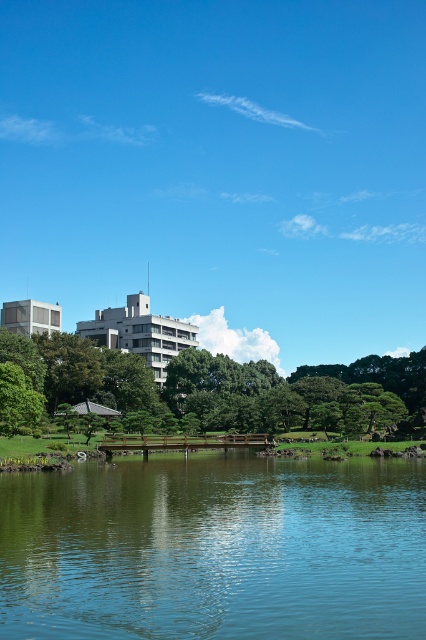
From the picture: Is transparent glass water at center above green leafy tree at center?

No.

Is point (268, 504) in front of point (238, 416)?

Yes, point (268, 504) is in front of point (238, 416).

What do you see at coordinates (215, 548) in the screenshot? I see `transparent glass water at center` at bounding box center [215, 548].

This screenshot has width=426, height=640. In order to click on transparent glass water at center in this screenshot , I will do `click(215, 548)`.